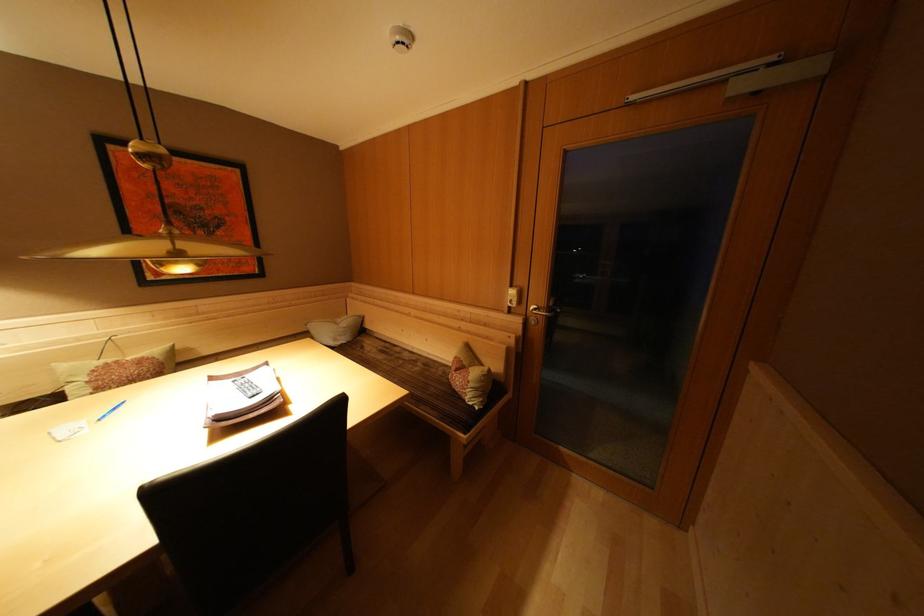
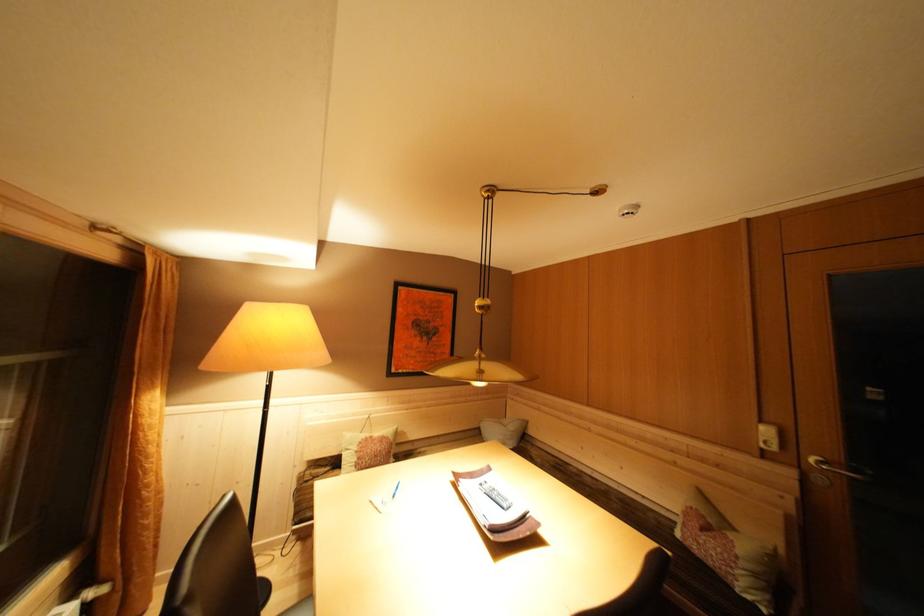
The point at (518, 291) is marked in the first image. Where is the corresponding point in the second image?

(768, 427)